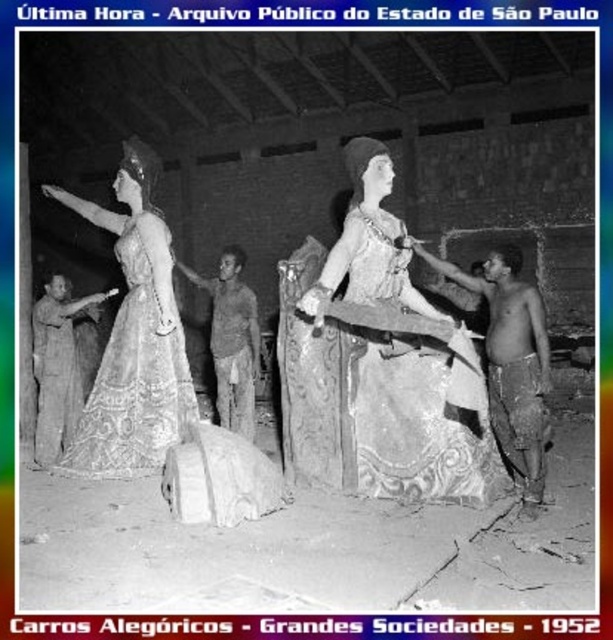
You are an art restorer working in this workshop. You need to move the shiny bronze statue at right to a different location. However, you must ensure that the brown textured fabric at center remains visible from your current viewpoint. Can you move the statue without blocking the fabric?

The shiny bronze statue at right is currently in front of the brown textured fabric at center. If you move the statue away from its current position, the brown textured fabric at center will become visible. Therefore, you can move the statue without blocking the fabric as long as it is not placed in front of the fabric again.

In the image, there is a matte gold dress at left. Where exactly is it located in terms of coordinates?

The matte gold dress at left is located at coordinates point [134,337].